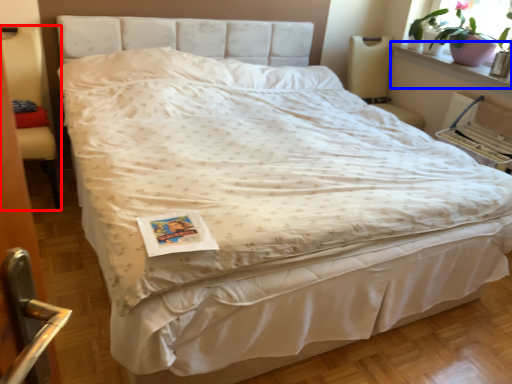
Question: Among these objects, which one is nearest to the camera, armchair (highlighted by a red box) or window sill (highlighted by a blue box)?

Choices:
 (A) armchair
 (B) window sill

Answer: (A)